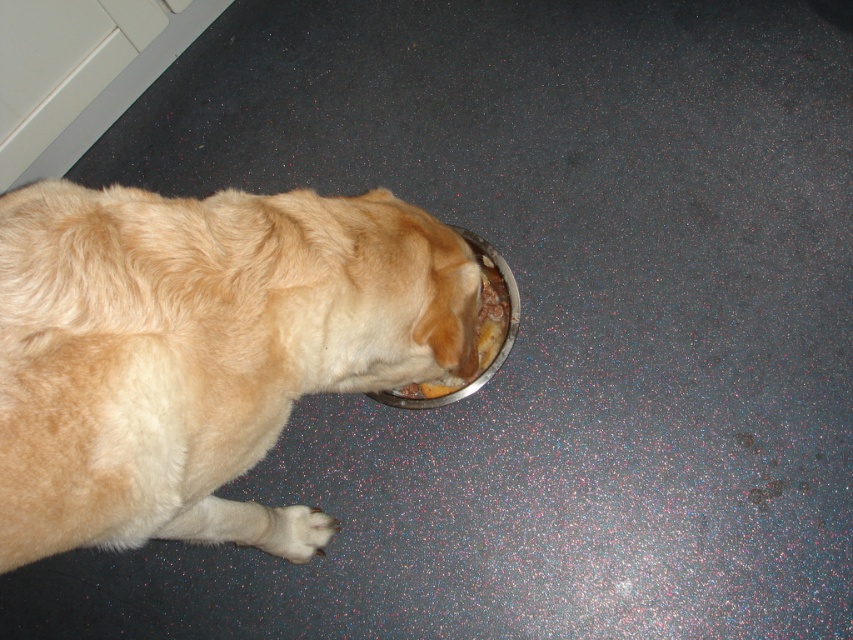
Question: Is golden fur dog at lower left below white fur paw at lower left?

Choices:
 (A) yes
 (B) no

Answer: (B)

Question: Is white fur paw at lower left in front of metallic silver bowl at lower center?

Choices:
 (A) yes
 (B) no

Answer: (A)

Question: Which point is farther to the camera?

Choices:
 (A) white fur paw at lower left
 (B) golden fur dog at lower left

Answer: (A)

Question: Which is farther from the golden fur dog at lower left?

Choices:
 (A) white fur paw at lower left
 (B) metallic silver bowl at lower center

Answer: (B)

Question: Is white fur paw at lower left thinner than metallic silver bowl at lower center?

Choices:
 (A) yes
 (B) no

Answer: (A)

Question: Which object appears farthest from the camera in this image?

Choices:
 (A) metallic silver bowl at lower center
 (B) golden fur dog at lower left

Answer: (A)